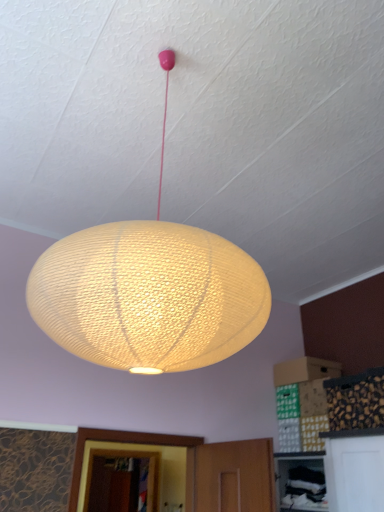
Question: Is matte yellow woven lantern at center to the left or to the right of matte white sphere at center in the image?

Choices:
 (A) left
 (B) right

Answer: (A)

Question: In the image, is matte yellow woven lantern at center positioned in front of or behind matte white sphere at center?

Choices:
 (A) front
 (B) behind

Answer: (B)

Question: From a real-world perspective, relative to matte white sphere at center, is matte yellow woven lantern at center vertically above or below?

Choices:
 (A) above
 (B) below

Answer: (A)

Question: From the image's perspective, is matte white sphere at center positioned above or below matte yellow woven lantern at center?

Choices:
 (A) above
 (B) below

Answer: (A)

Question: Would you say matte white sphere at center is to the left or to the right of matte yellow woven lantern at center in the picture?

Choices:
 (A) left
 (B) right

Answer: (B)

Question: Considering the positions of matte white sphere at center and matte yellow woven lantern at center in the image, is matte white sphere at center bigger or smaller than matte yellow woven lantern at center?

Choices:
 (A) small
 (B) big

Answer: (B)

Question: From a real-world perspective, is matte white sphere at center positioned above or below matte yellow woven lantern at center?

Choices:
 (A) below
 (B) above

Answer: (A)